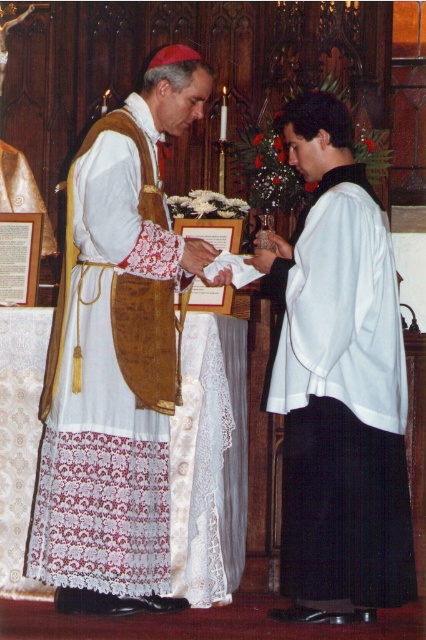
You are a photographer setting up for a ceremony. You need to ensure that both the matte gold vestment at center and the white satin robe at center are fully visible in your shot. Given their sizes, which object requires a wider framing to capture its full width?

The matte gold vestment at center requires a wider framing because its width is larger than that of the white satin robe at center.

You are an assistant at the ceremony and need to retrieve an item from the white satin robe at center. The matte gold vestment at center is blocking your path. Can you move around the vestment to access the robe?

The matte gold vestment at center is in front of the white satin robe at center, so you can move around it to access the robe.

You are attending a religious ceremony in a church. You notice the matte gold vestment at center. Where exactly is it positioned in the scene?

The matte gold vestment at center is located at point [117,358].